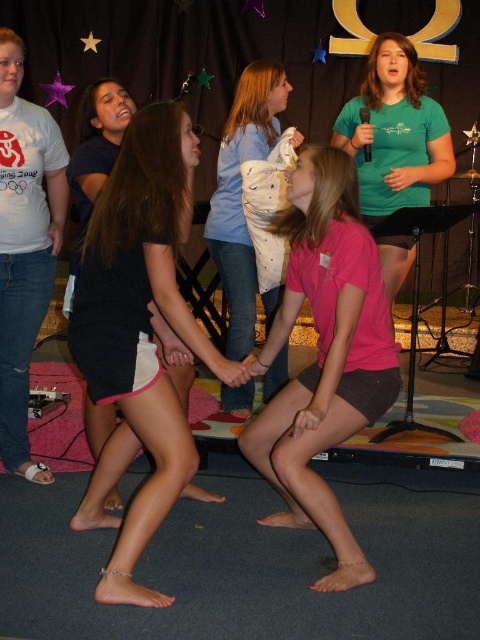
Consider the image. Who is positioned more to the left, white fabric shorts at center or white dotted shirt at center?

Positioned to the left is white fabric shorts at center.

Who is more forward, (94, 212) or (212, 244)?

Point (94, 212)

The image size is (480, 640). I want to click on white fabric shorts at center, so click(x=140, y=337).

Can you confirm if pink matte shorts at center is positioned to the left of white dotted shirt at center?

Incorrect, pink matte shorts at center is not on the left side of white dotted shirt at center.

Does point (294, 461) come closer to viewer compared to point (257, 108)?

Yes, it is in front of point (257, 108).

I want to click on pink matte shorts at center, so click(324, 355).

Who is lower down, white fabric shorts at center or pink matte shorts at center?

pink matte shorts at center is lower down.

Is white fabric shorts at center above pink matte shorts at center?

Yes, white fabric shorts at center is above pink matte shorts at center.

Is point (165, 193) positioned in front of point (286, 460)?

Yes, it is.

Locate an element on the screen. This screenshot has width=480, height=640. white fabric shorts at center is located at coordinates point(140,337).